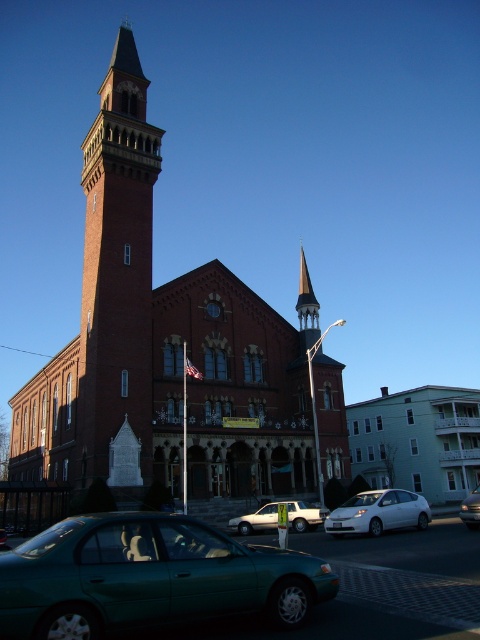
You are a tour guide leading a group to the entrance of the brick bell tower at left. Your tour van, which is the white matte car at lower right, is parked nearby. Can you walk from the van to the tower entrance in under 2 minutes if you walk at a normal pace?

The distance between the brick bell tower at left and the white matte car at lower right is 28.74 meters. At a normal walking speed of about 1.4 meters per second, it would take approximately 20.5 seconds to cover this distance. Therefore, you can easily walk from the van to the tower entrance in under 2 minutes.

You are a photographer planning to capture the brick church at center and the white matte van at lower center in a single frame. Based on their sizes, which object should you focus on first to ensure both are in the shot?

The brick church at center is taller than the white matte van at lower center, so you should focus on the brick church at center first to ensure its full height is captured while still including the van in the frame.